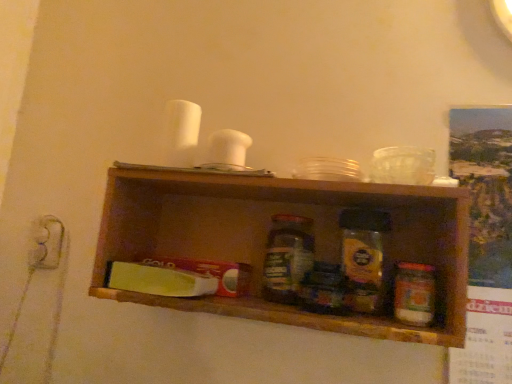
Question: From the image's perspective, is translucent glass jar at center, which appears as the first bottle when viewed from the left, beneath matte white electric outlet at left?

Choices:
 (A) yes
 (B) no

Answer: (A)

Question: Is translucent glass jar at center, positioned as the 2th bottle in front-to-back order, not near matte white electric outlet at left?

Choices:
 (A) yes
 (B) no

Answer: (B)

Question: Is translucent glass jar at center, the second bottle positioned from the right, facing towards matte white electric outlet at left?

Choices:
 (A) no
 (B) yes

Answer: (A)

Question: From a real-world perspective, is translucent glass jar at center, positioned as the 2th bottle in front-to-back order, on matte white electric outlet at left?

Choices:
 (A) yes
 (B) no

Answer: (A)

Question: Can you see translucent glass jar at center, which appears as the first bottle when viewed from the left, touching matte white electric outlet at left?

Choices:
 (A) yes
 (B) no

Answer: (B)

Question: Is the position of translucent glass jar at center, the 1th bottle positioned from the back, less distant than that of matte white electric outlet at left?

Choices:
 (A) no
 (B) yes

Answer: (B)

Question: Considering the relative positions of translucent plastic jar at center-right, positioned as the first bottle in front-to-back order, and translucent glass jar at center in the image provided, is translucent plastic jar at center-right, positioned as the first bottle in front-to-back order, in front of translucent glass jar at center?

Choices:
 (A) no
 (B) yes

Answer: (B)

Question: Does translucent plastic jar at center-right, the 2th bottle viewed from the left, lie behind translucent glass jar at center?

Choices:
 (A) no
 (B) yes

Answer: (A)

Question: From the image's perspective, is translucent plastic jar at center-right, positioned as the first bottle in front-to-back order, on translucent glass jar at center?

Choices:
 (A) no
 (B) yes

Answer: (A)

Question: Is translucent plastic jar at center-right, the 2th bottle positioned from the back, to the left of translucent glass jar at center from the viewer's perspective?

Choices:
 (A) yes
 (B) no

Answer: (B)

Question: Does translucent plastic jar at center-right, placed as the first bottle when sorted from right to left, appear on the right side of translucent glass jar at center?

Choices:
 (A) yes
 (B) no

Answer: (A)

Question: From a real-world perspective, is translucent plastic jar at center-right, the 2th bottle positioned from the back, located beneath translucent glass jar at center?

Choices:
 (A) no
 (B) yes

Answer: (B)

Question: Could you tell me if green plastic butter at center is turned towards matte white electric outlet at left?

Choices:
 (A) no
 (B) yes

Answer: (A)